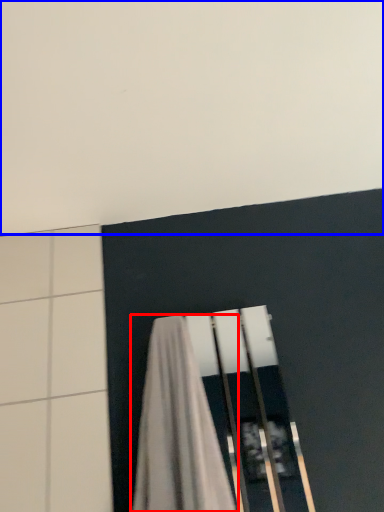
Question: Which object is further to the camera taking this photo, curtain (highlighted by a red box) or backdrop (highlighted by a blue box)?

Choices:
 (A) curtain
 (B) backdrop

Answer: (A)